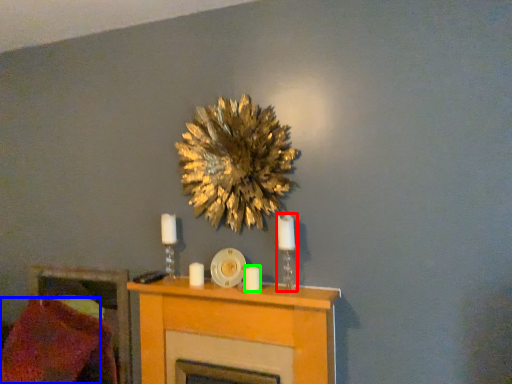
Question: Which object is the farthest from candle holder (highlighted by a red box)? Choose among these: pillow (highlighted by a blue box) or candle (highlighted by a green box).

Choices:
 (A) pillow
 (B) candle

Answer: (A)